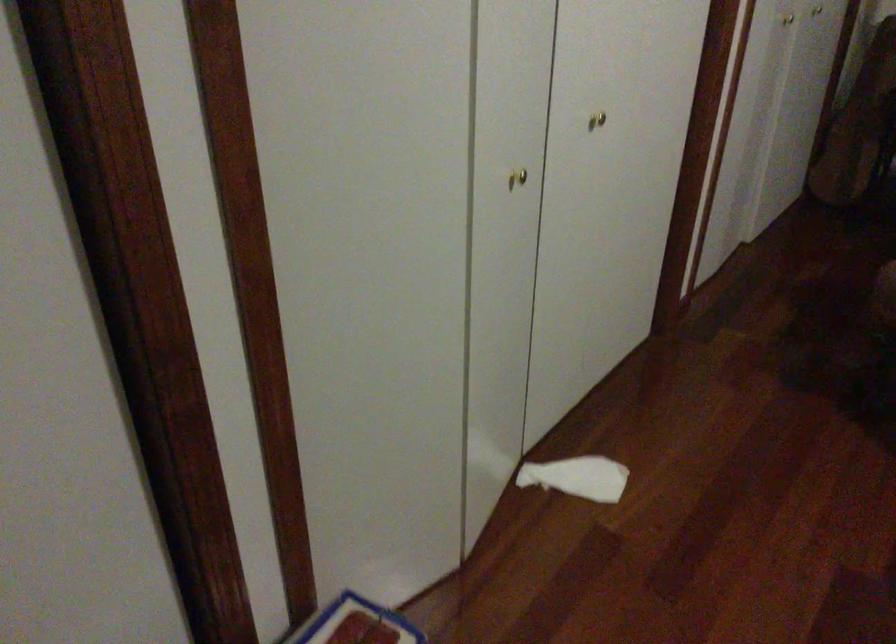
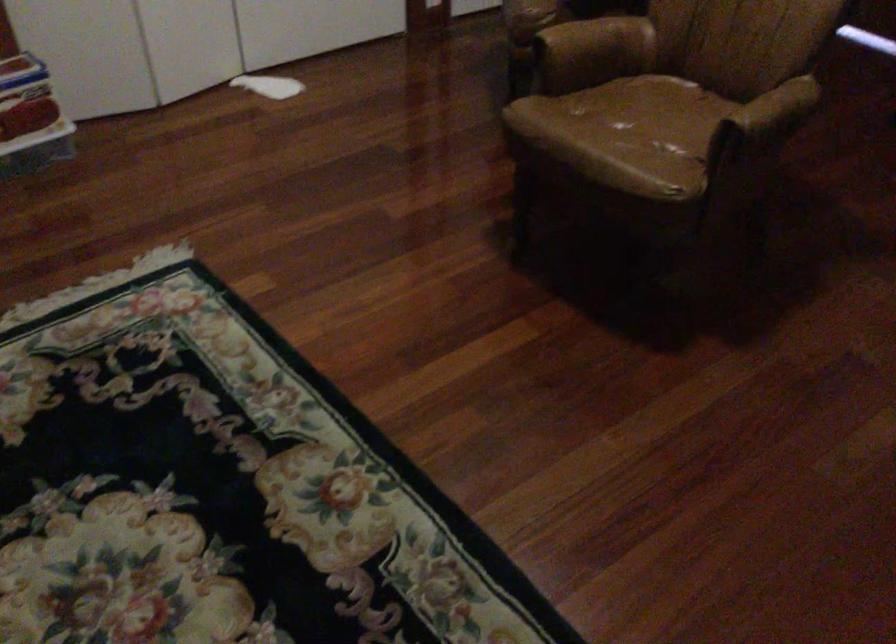
What movement of the cameraman would produce the second image?

The cameraman moved toward right, backward.